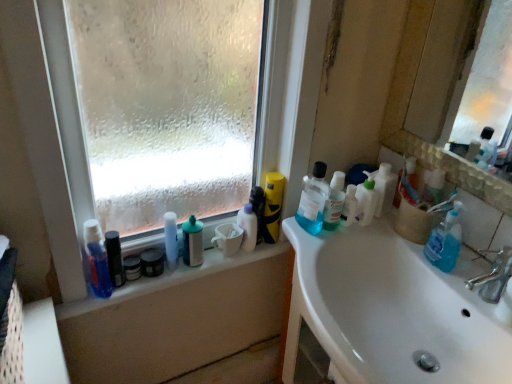
This screenshot has height=384, width=512. What do you see at coordinates (313, 200) in the screenshot? I see `blue translucent liquid at sink, the first cleaning product from the left` at bounding box center [313, 200].

What do you see at coordinates (334, 201) in the screenshot? I see `blue translucent mouthwash at center, the 7th toiletry positioned from the left` at bounding box center [334, 201].

Identify the location of yellow matte cylindrical container at center, the sixth toiletry positioned from the left. The image size is (512, 384). (273, 206).

In the scene shown: Measure the distance between point (490, 359) and camera.

The depth of point (490, 359) is 39.17 inches.

In order to face matte plastic spray can at window, which is counted as the 4th toiletry, starting from the left, should I rotate leftwards or rightwards?

To face it directly, rotate left by 8.346 degrees.

I want to click on matte plastic spray can at window, marked as the 5th toiletry in a right-to-left arrangement, so click(x=192, y=242).

What do you see at coordinates (97, 259) in the screenshot? This screenshot has height=384, width=512. I see `blue glossy lotion at left, which is the 8th toiletry in right-to-left order` at bounding box center [97, 259].

What do you see at coordinates (170, 238) in the screenshot? This screenshot has height=384, width=512. I see `white glossy bottle at center, which is the 3th toiletry in left-to-right order` at bounding box center [170, 238].

At what (x,y) coordinates should I click in order to perform the action: click on blue translucent liquid at sink, which is the 3th cleaning product in right-to-left order. Please return your answer as a coordinate pair (x, y). The image size is (512, 384). Looking at the image, I should click on (313, 200).

How many degrees apart are the facing directions of frosted glass window at upper left and white glossy bottle at center, placed as the sixth toiletry when sorted from right to left?

0.762 degrees.

Looking at their sizes, would you say frosted glass window at upper left is wider or thinner than white glossy bottle at center, placed as the sixth toiletry when sorted from right to left?

In the image, frosted glass window at upper left appears to be wider than white glossy bottle at center, placed as the sixth toiletry when sorted from right to left.

Can you confirm if frosted glass window at upper left is bigger than white glossy bottle at center, placed as the sixth toiletry when sorted from right to left?

Yes.

Is frosted glass window at upper left positioned beyond the bounds of white glossy bottle at center, placed as the sixth toiletry when sorted from right to left?

frosted glass window at upper left is positioned outside white glossy bottle at center, placed as the sixth toiletry when sorted from right to left.

Are frosted glass window at upper left and translucent plastic toothbrush at upper right, which is counted as the 8th toiletry, starting from the left, making contact?

No, frosted glass window at upper left is not next to translucent plastic toothbrush at upper right, which is counted as the 8th toiletry, starting from the left.

Is frosted glass window at upper left inside the boundaries of translucent plastic toothbrush at upper right, which is counted as the 1th toiletry, starting from the right, or outside?

frosted glass window at upper left is not enclosed by translucent plastic toothbrush at upper right, which is counted as the 1th toiletry, starting from the right.

Does frosted glass window at upper left appear on the right side of translucent plastic toothbrush at upper right, which is counted as the 1th toiletry, starting from the right?

Incorrect, frosted glass window at upper left is not on the right side of translucent plastic toothbrush at upper right, which is counted as the 1th toiletry, starting from the right.

Can you confirm if frosted glass window at upper left is shorter than translucent plastic toothbrush at upper right, which is counted as the 1th toiletry, starting from the right?

Incorrect, the height of frosted glass window at upper left does not fall short of that of translucent plastic toothbrush at upper right, which is counted as the 1th toiletry, starting from the right.

Could you tell me if white glossy sink at lower right is turned towards translucent plastic toothbrush at upper right, which is counted as the 8th toiletry, starting from the left?

No, white glossy sink at lower right is not facing towards translucent plastic toothbrush at upper right, which is counted as the 8th toiletry, starting from the left.

Which object is thinner, white glossy sink at lower right or translucent plastic toothbrush at upper right, which is counted as the 8th toiletry, starting from the left?

translucent plastic toothbrush at upper right, which is counted as the 8th toiletry, starting from the left.

Can you tell me how much white glossy sink at lower right and translucent plastic toothbrush at upper right, which is counted as the 8th toiletry, starting from the left, differ in facing direction?

There is a 85.9-degree angle between the facing directions of white glossy sink at lower right and translucent plastic toothbrush at upper right, which is counted as the 8th toiletry, starting from the left.

Does white glossy sink at lower right have a smaller size compared to translucent plastic toothbrush at upper right, which is counted as the 8th toiletry, starting from the left?

Actually, white glossy sink at lower right might be larger than translucent plastic toothbrush at upper right, which is counted as the 8th toiletry, starting from the left.

In the scene shown: Is blue glossy lotion at left, which is the 8th toiletry in right-to-left order, positioned with its back to white plastic bottle at upper right, the first cleaning product from the right?

blue glossy lotion at left, which is the 8th toiletry in right-to-left order, does not have its back to white plastic bottle at upper right, the first cleaning product from the right.

Based on the photo, from a real-world perspective, is blue glossy lotion at left, which is counted as the 1th toiletry, starting from the left, above or below white plastic bottle at upper right, the first cleaning product from the right?

From a real-world perspective, blue glossy lotion at left, which is counted as the 1th toiletry, starting from the left, is physically below white plastic bottle at upper right, the first cleaning product from the right.

How far apart are blue glossy lotion at left, which is the 8th toiletry in right-to-left order, and white plastic bottle at upper right, the 3th cleaning product viewed from the left?

The distance of blue glossy lotion at left, which is the 8th toiletry in right-to-left order, from white plastic bottle at upper right, the 3th cleaning product viewed from the left, is 32.40 inches.

In the image, is blue glossy lotion at left, which is the 8th toiletry in right-to-left order, positioned in front of or behind white plastic bottle at upper right, the 3th cleaning product viewed from the left?

Visually, blue glossy lotion at left, which is the 8th toiletry in right-to-left order, is located in front of white plastic bottle at upper right, the 3th cleaning product viewed from the left.

In terms of width, does matte black jar at window sill, the seventh toiletry viewed from the right, look wider or thinner when compared to white glossy sink at lower right?

In the image, matte black jar at window sill, the seventh toiletry viewed from the right, appears to be more narrow than white glossy sink at lower right.

From the picture: Is matte black jar at window sill, the seventh toiletry viewed from the right, spatially inside white glossy sink at lower right, or outside of it?

matte black jar at window sill, the seventh toiletry viewed from the right, is not enclosed by white glossy sink at lower right.

Are matte black jar at window sill, the seventh toiletry viewed from the right, and white glossy sink at lower right located far from each other?

No, there isn't a large distance between matte black jar at window sill, the seventh toiletry viewed from the right, and white glossy sink at lower right.

Which object is positioned more to the left, yellow matte cylindrical container at center, which ranks as the 3th toiletry in right-to-left order, or white glossy sink at lower right?

From the viewer's perspective, yellow matte cylindrical container at center, which ranks as the 3th toiletry in right-to-left order, appears more on the left side.

Which is farther, (275,225) or (495,375)?

Point (275,225)

Consider the image. Considering the sizes of objects yellow matte cylindrical container at center, the sixth toiletry positioned from the left, and white glossy sink at lower right in the image provided, who is shorter, yellow matte cylindrical container at center, the sixth toiletry positioned from the left, or white glossy sink at lower right?

Standing shorter between the two is yellow matte cylindrical container at center, the sixth toiletry positioned from the left.

Does matte plastic spray can at window, which is counted as the 4th toiletry, starting from the left, touch blue translucent mouthwash at center, the 7th toiletry positioned from the left?

They are not placed beside each other.

From a real-world perspective, who is located lower, matte plastic spray can at window, marked as the 5th toiletry in a right-to-left arrangement, or blue translucent mouthwash at center, arranged as the 2th toiletry when viewed from the right?

matte plastic spray can at window, marked as the 5th toiletry in a right-to-left arrangement, is physically lower.

Is matte plastic spray can at window, marked as the 5th toiletry in a right-to-left arrangement, positioned beyond the bounds of blue translucent mouthwash at center, the 7th toiletry positioned from the left?

matte plastic spray can at window, marked as the 5th toiletry in a right-to-left arrangement, is positioned outside blue translucent mouthwash at center, the 7th toiletry positioned from the left.

Starting from the frosted glass window at upper left, which toiletry is the 2nd one to the left? Please provide its 2D coordinates.

[(170, 238)]

You are a GUI agent. You are given a task and a screenshot of the screen. Output one action in this format:
    pyautogui.click(x=<x>, y=<y>)
    Task: Click on the window above the translucent plastic toothbrush at upper right, which is counted as the 1th toiletry, starting from the right (from a real-world perspective)
    The width and height of the screenshot is (512, 384).
    Given the screenshot: What is the action you would take?
    pyautogui.click(x=281, y=93)

When comparing their distances from white plastic bottle at upper right, the 3th cleaning product viewed from the left, does translucent plastic toothbrush at upper right, which is counted as the 8th toiletry, starting from the left, or blue translucent liquid at sink, the first cleaning product from the left, seem further?

blue translucent liquid at sink, the first cleaning product from the left, is positioned further to the anchor white plastic bottle at upper right, the 3th cleaning product viewed from the left.

Estimate the real-world distances between objects in this image. Which object is further from white glossy sink at lower right, clear plastic window sill at upper left or matte black jar at window sill, the seventh toiletry viewed from the right?

matte black jar at window sill, the seventh toiletry viewed from the right.

Considering their positions, is white glossy bottle at center, which is the 3th toiletry in left-to-right order, positioned further to black matte bottle at left, the second mouthwash in the right-to-left sequence, than white glossy sink at lower right?

white glossy sink at lower right is positioned further to the anchor black matte bottle at left, the second mouthwash in the right-to-left sequence.

Based on their spatial positions, is matte plastic spray can at window, marked as the 5th toiletry in a right-to-left arrangement, or clear plastic window sill at upper left further from white glossy sink at lower right?

matte plastic spray can at window, marked as the 5th toiletry in a right-to-left arrangement, is positioned further to the anchor white glossy sink at lower right.

Which object lies further to the anchor point white glossy sink at lower right, white pump bottle at upper right, which is the second cleaning product from left to right, or frosted glass window at upper left?

frosted glass window at upper left.

Considering their positions, is white plastic bottle at upper right, the first cleaning product from the right, positioned closer to white pump bottle at upper right, which is the second cleaning product from left to right, than black matte jar at left, which is the 2th mouthwash from left to right?

white plastic bottle at upper right, the first cleaning product from the right, is positioned closer to the anchor white pump bottle at upper right, which is the second cleaning product from left to right.

When comparing their distances from matte black jar at window sill, the seventh toiletry viewed from the right, does translucent plastic bottle at center, which is counted as the fifth toiletry, starting from the left, or yellow matte cylindrical container at center, the sixth toiletry positioned from the left, seem further?

Among the two, yellow matte cylindrical container at center, the sixth toiletry positioned from the left, is located further to matte black jar at window sill, the seventh toiletry viewed from the right.

Based on the photo, considering their positions, is matte plastic spray can at window, marked as the 5th toiletry in a right-to-left arrangement, positioned closer to frosted glass window at upper left than translucent plastic bottle at center, which is counted as the fifth toiletry, starting from the left?

translucent plastic bottle at center, which is counted as the fifth toiletry, starting from the left.

The height and width of the screenshot is (384, 512). What are the coordinates of `window sill between blue glossy lotion at left, which is counted as the 1th toiletry, starting from the left, and translucent plastic bottle at center, which is counted as the fifth toiletry, starting from the left, in the horizontal direction` in the screenshot? It's located at 170,279.

You are a GUI agent. You are given a task and a screenshot of the screen. Output one action in this format:
    pyautogui.click(x=<x>, y=<y>)
    Task: Click on the window sill situated between matte black jar at window sill, the seventh toiletry viewed from the right, and white plastic bottle at upper right, the first cleaning product from the right, from left to right
    The image size is (512, 384).
    Given the screenshot: What is the action you would take?
    pyautogui.click(x=170, y=279)

At what (x,y) coordinates should I click in order to perform the action: click on window sill situated between blue glossy lotion at left, which is the 8th toiletry in right-to-left order, and yellow matte cylindrical container at center, which ranks as the 3th toiletry in right-to-left order, from left to right. Please return your answer as a coordinate pair (x, y). The image size is (512, 384). Looking at the image, I should click on (170, 279).

Find the location of a particular element. The width and height of the screenshot is (512, 384). mouthwash located between black matte bottle at left, the second mouthwash in the right-to-left sequence, and white pump bottle at upper right, acting as the 2th cleaning product starting from the right, in the left-right direction is located at coordinates (152, 262).